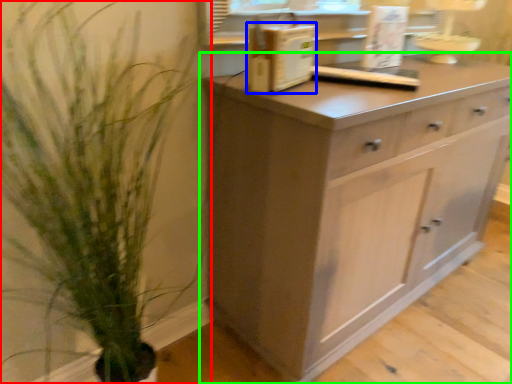
Question: Estimate the real-world distances between objects in this image. Which object is farther from houseplant (highlighted by a red box), appliance (highlighted by a blue box) or chest of drawers (highlighted by a green box)?

Choices:
 (A) appliance
 (B) chest of drawers

Answer: (A)